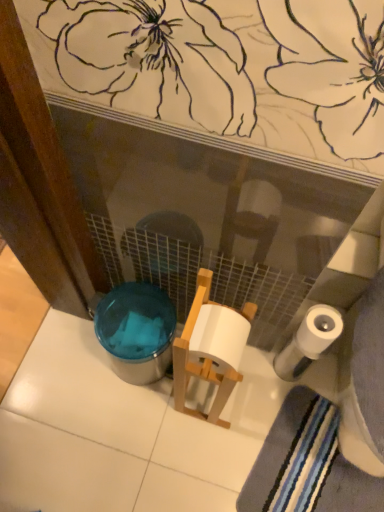
Question: Is striped cotton bath towel at lower right looking in the opposite direction of translucent plastic potty at lower left?

Choices:
 (A) yes
 (B) no

Answer: (B)

Question: Does striped cotton bath towel at lower right have a greater width compared to translucent plastic potty at lower left?

Choices:
 (A) yes
 (B) no

Answer: (A)

Question: Is striped cotton bath towel at lower right bigger than translucent plastic potty at lower left?

Choices:
 (A) no
 (B) yes

Answer: (A)

Question: Considering the relative sizes of striped cotton bath towel at lower right and translucent plastic potty at lower left in the image provided, is striped cotton bath towel at lower right shorter than translucent plastic potty at lower left?

Choices:
 (A) yes
 (B) no

Answer: (A)

Question: Does striped cotton bath towel at lower right have a greater height compared to translucent plastic potty at lower left?

Choices:
 (A) no
 (B) yes

Answer: (A)

Question: Is white matte toilet paper at lower right inside or outside of translucent plastic potty at lower left?

Choices:
 (A) outside
 (B) inside

Answer: (A)

Question: From a real-world perspective, is white matte toilet paper at lower right positioned above or below translucent plastic potty at lower left?

Choices:
 (A) above
 (B) below

Answer: (A)

Question: From the image's perspective, is white matte toilet paper at lower right located above or below translucent plastic potty at lower left?

Choices:
 (A) above
 (B) below

Answer: (A)

Question: Is white matte toilet paper at lower right wider or thinner than translucent plastic potty at lower left?

Choices:
 (A) wide
 (B) thin

Answer: (B)

Question: Looking at the image, does white matte toilet paper at lower right seem bigger or smaller compared to striped cotton bath towel at lower right?

Choices:
 (A) small
 (B) big

Answer: (A)

Question: Considering the positions of white matte toilet paper at lower right and striped cotton bath towel at lower right in the image, is white matte toilet paper at lower right taller or shorter than striped cotton bath towel at lower right?

Choices:
 (A) tall
 (B) short

Answer: (A)

Question: Considering the positions of white matte toilet paper at lower right and striped cotton bath towel at lower right in the image, is white matte toilet paper at lower right wider or thinner than striped cotton bath towel at lower right?

Choices:
 (A) thin
 (B) wide

Answer: (A)

Question: From the image's perspective, is white matte toilet paper at lower right located above or below striped cotton bath towel at lower right?

Choices:
 (A) below
 (B) above

Answer: (B)

Question: Considering the positions of translucent plastic potty at lower left and striped cotton bath towel at lower right in the image, is translucent plastic potty at lower left taller or shorter than striped cotton bath towel at lower right?

Choices:
 (A) tall
 (B) short

Answer: (A)

Question: Based on their sizes in the image, would you say translucent plastic potty at lower left is bigger or smaller than striped cotton bath towel at lower right?

Choices:
 (A) big
 (B) small

Answer: (A)